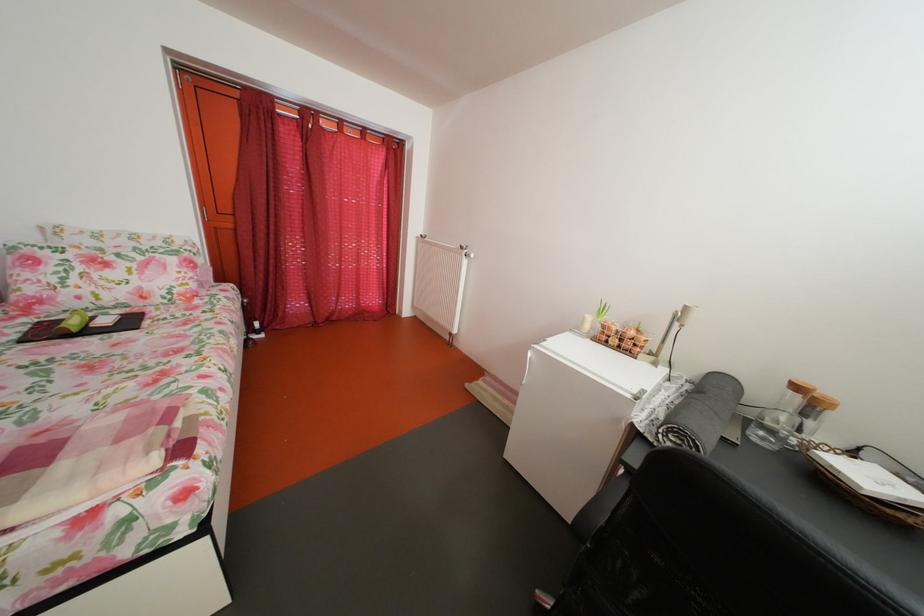
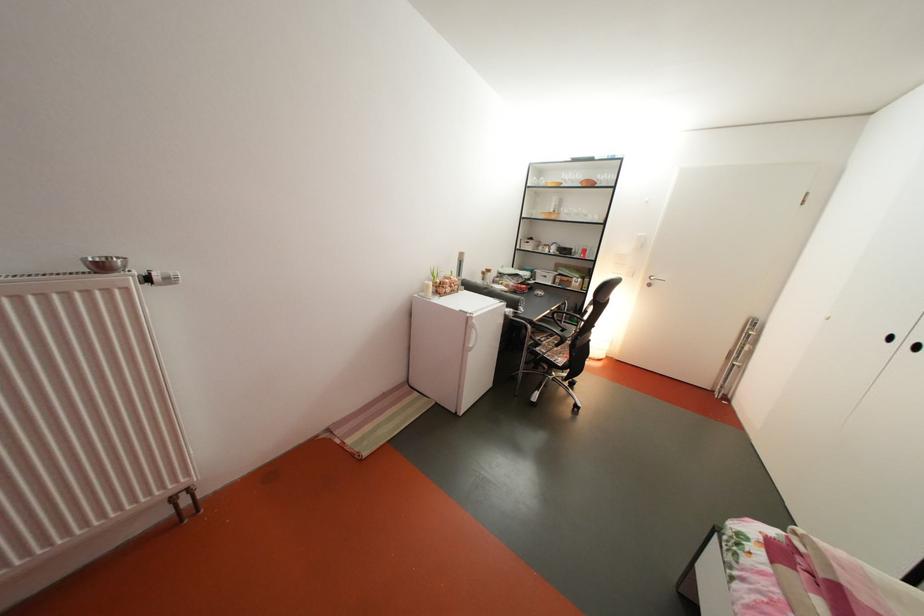
Where in the second image is the point corresponding to (x=594, y=325) from the first image?

(439, 293)